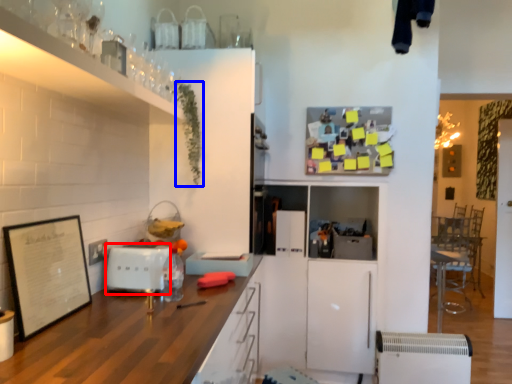
Question: Which object is further to the camera taking this photo, appliance (highlighted by a red box) or plant (highlighted by a blue box)?

Choices:
 (A) appliance
 (B) plant

Answer: (B)